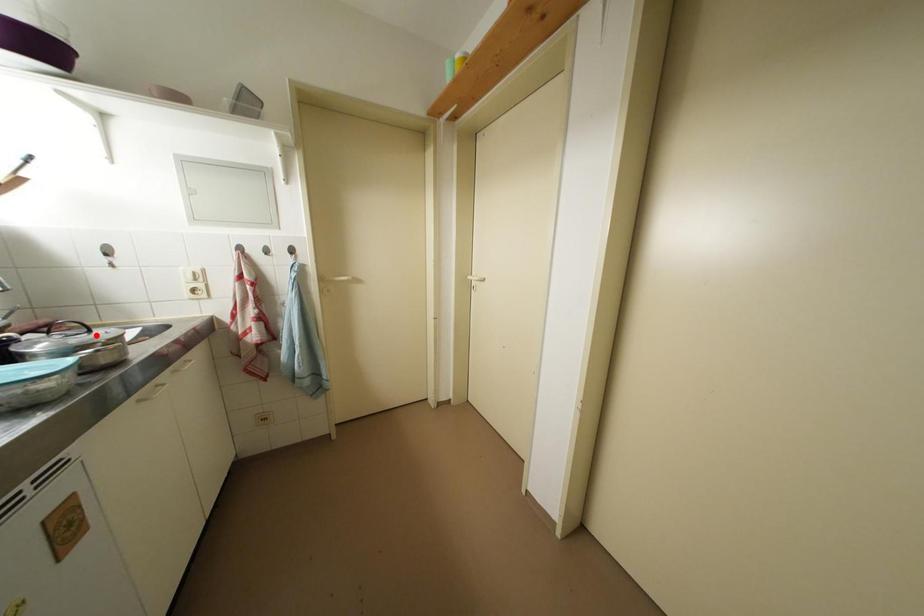
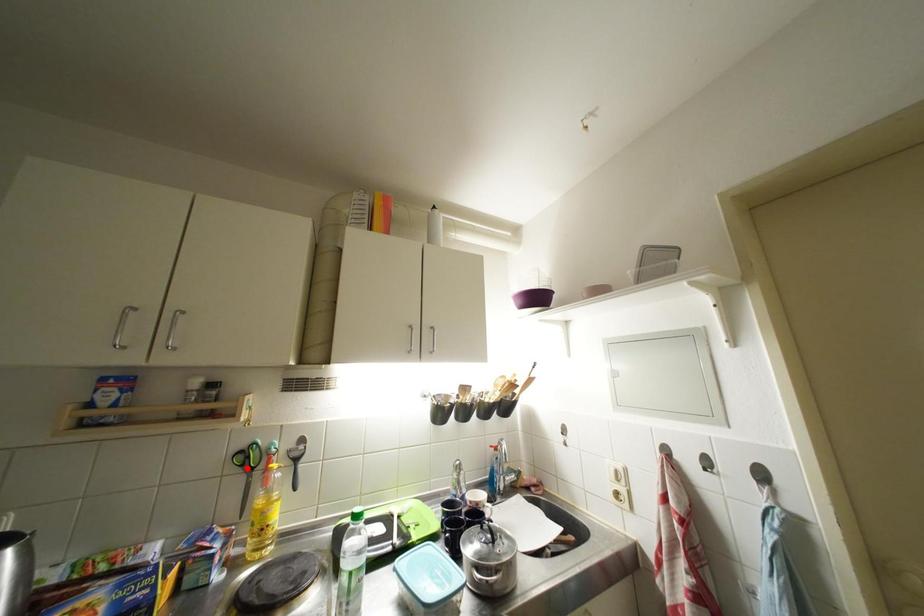
I am providing you with two images of the same scene from different viewpoints. A red point is marked on the first image and another point is marked on the second image. Are the points marked in image1 and image2 representing the same 3D position?

No